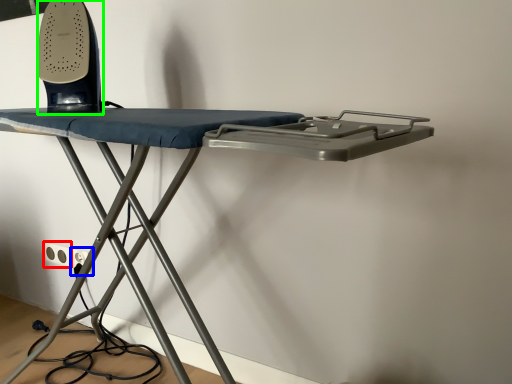
Question: Which object is the farthest from electric outlet (highlighted by a red box)? Choose among these: electric outlet (highlighted by a blue box) or equipment (highlighted by a green box).

Choices:
 (A) electric outlet
 (B) equipment

Answer: (B)